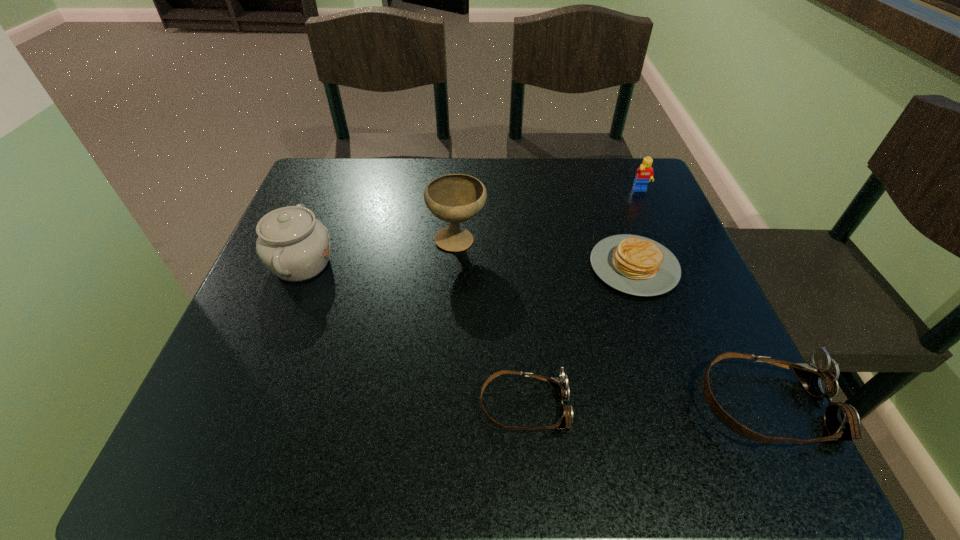
Find the location of a particular element. the shorter goggles is located at coordinates (560, 385).

Where is `the right goggles`? the right goggles is located at coordinates (819, 377).

This screenshot has width=960, height=540. I want to click on the taller goggles, so click(819, 377).

The height and width of the screenshot is (540, 960). Find the location of `Lego`. Lego is located at coordinates (645, 172).

Find the location of a particular element. Image resolution: width=960 pixels, height=540 pixels. the farthest object is located at coordinates (645, 172).

You are a GUI agent. You are given a task and a screenshot of the screen. Output one action in this format:
    pyautogui.click(x=<x>, y=<y>)
    Task: Click on the chalice
    
    Given the screenshot: What is the action you would take?
    pyautogui.click(x=455, y=198)

What are the coordinates of `pancake` in the screenshot? It's located at (636, 265).

You are a GUI agent. You are given a task and a screenshot of the screen. Output one action in this format:
    pyautogui.click(x=<x>, y=<y>)
    Task: Click on the chinaware
    This screenshot has height=540, width=960.
    Given the screenshot: What is the action you would take?
    pyautogui.click(x=291, y=243)

Find the location of a particular element. The width and height of the screenshot is (960, 540). free space located on the front-facing side of the left goggles is located at coordinates (758, 407).

At what (x,y) coordinates should I click in order to perform the action: click on free space located on the face of the third tallest object. Please return your answer as a coordinate pair (x, y). The height and width of the screenshot is (540, 960). Looking at the image, I should click on [x=649, y=211].